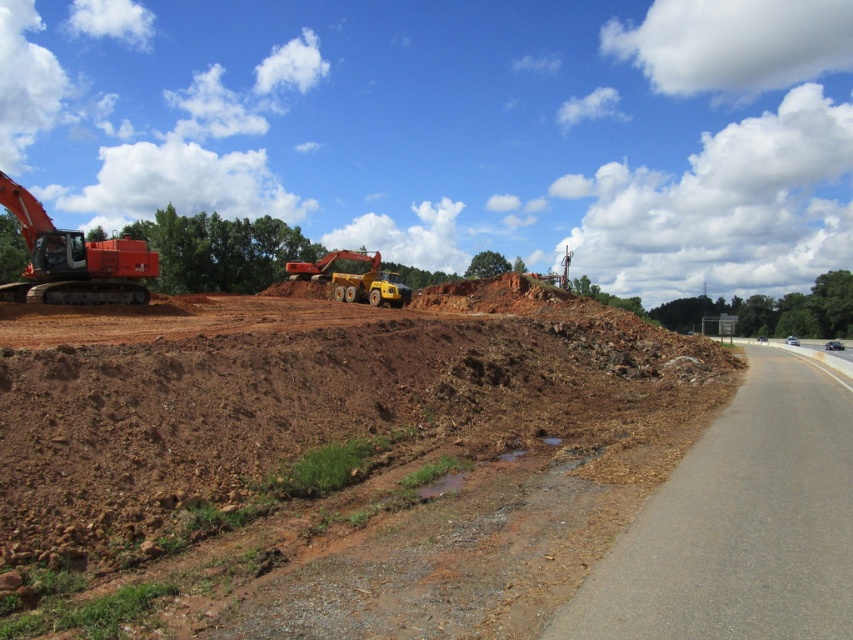
Who is shorter, gray asphalt road at right or yellow rubber dump truck at center?

Standing shorter between the two is gray asphalt road at right.

Locate an element on the screen. The image size is (853, 640). gray asphalt road at right is located at coordinates (740, 524).

You are a GUI agent. You are given a task and a screenshot of the screen. Output one action in this format:
    pyautogui.click(x=<x>, y=<y>)
    Task: Click on the gray asphalt road at right
    Image resolution: width=853 pixels, height=640 pixels.
    Given the screenshot: What is the action you would take?
    pyautogui.click(x=740, y=524)

Between brown soil at lower left and orange metallic excavator at left, which one appears on the left side from the viewer's perspective?

orange metallic excavator at left

This screenshot has height=640, width=853. I want to click on brown soil at lower left, so click(x=332, y=461).

The image size is (853, 640). I want to click on brown soil at lower left, so click(332, 461).

Does brown soil at lower left have a lesser width compared to gray asphalt road at right?

Incorrect, brown soil at lower left's width is not less than gray asphalt road at right's.

I want to click on brown soil at lower left, so click(x=332, y=461).

Identify the location of brown soil at lower left. This screenshot has height=640, width=853. (332, 461).

Identify the location of brown soil at lower left. (332, 461).